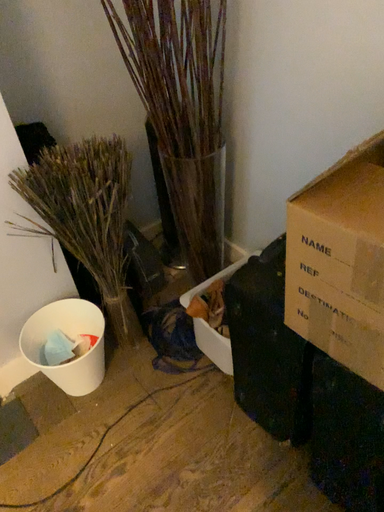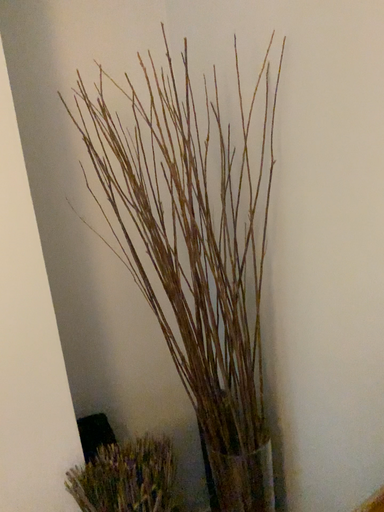
Question: How did the camera likely rotate when shooting the video?

Choices:
 (A) rotated right
 (B) rotated left

Answer: (B)